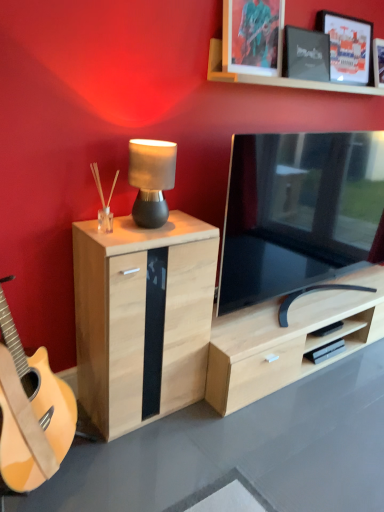
Question: Does black matte picture frame at upper right, which is the second picture frame from left to right, have a greater width compared to metallic silver picture frame at upper center, the 1th picture frame viewed from the left?

Choices:
 (A) no
 (B) yes

Answer: (A)

Question: Is black matte picture frame at upper right, which is the second picture frame from left to right, positioned behind metallic silver picture frame at upper center, the 1th picture frame viewed from the left?

Choices:
 (A) yes
 (B) no

Answer: (A)

Question: From a real-world perspective, is black matte picture frame at upper right, which is the second picture frame from left to right, located higher than metallic silver picture frame at upper center, the 1th picture frame viewed from the left?

Choices:
 (A) yes
 (B) no

Answer: (B)

Question: Does black matte picture frame at upper right, the 2th picture frame viewed from the right, come in front of metallic silver picture frame at upper center, the 1th picture frame viewed from the left?

Choices:
 (A) no
 (B) yes

Answer: (A)

Question: Considering the relative sizes of black matte picture frame at upper right, which is the second picture frame from left to right, and metallic silver picture frame at upper center, the 1th picture frame viewed from the left, in the image provided, is black matte picture frame at upper right, which is the second picture frame from left to right, taller than metallic silver picture frame at upper center, the 1th picture frame viewed from the left,?

Choices:
 (A) no
 (B) yes

Answer: (A)

Question: From a real-world perspective, is black matte picture frame at upper right, which is the second picture frame from left to right, under metallic silver picture frame at upper center, which is counted as the 3th picture frame, starting from the right?

Choices:
 (A) yes
 (B) no

Answer: (A)

Question: Is matte black picture frame at upper right, the 3th picture frame when ordered from left to right, completely or partially inside matte black lamp at center?

Choices:
 (A) no
 (B) yes

Answer: (A)

Question: Is matte black lamp at center further to the viewer compared to matte black picture frame at upper right, the first picture frame from the right?

Choices:
 (A) yes
 (B) no

Answer: (B)

Question: Could you tell me if matte black lamp at center is facing matte black picture frame at upper right, the first picture frame from the right?

Choices:
 (A) no
 (B) yes

Answer: (A)

Question: Is matte black lamp at center placed right next to matte black picture frame at upper right, the first picture frame from the right?

Choices:
 (A) yes
 (B) no

Answer: (B)

Question: Considering the relative sizes of matte black lamp at center and matte black picture frame at upper right, the 3th picture frame when ordered from left to right, in the image provided, is matte black lamp at center shorter than matte black picture frame at upper right, the 3th picture frame when ordered from left to right,?

Choices:
 (A) yes
 (B) no

Answer: (A)

Question: Considering the relative sizes of matte black lamp at center and matte black picture frame at upper right, the 3th picture frame when ordered from left to right, in the image provided, is matte black lamp at center thinner than matte black picture frame at upper right, the 3th picture frame when ordered from left to right,?

Choices:
 (A) no
 (B) yes

Answer: (A)

Question: Is metallic silver picture frame at upper center, the 1th picture frame viewed from the left, at the right side of black matte picture frame at upper right, the 2th picture frame viewed from the right?

Choices:
 (A) yes
 (B) no

Answer: (B)